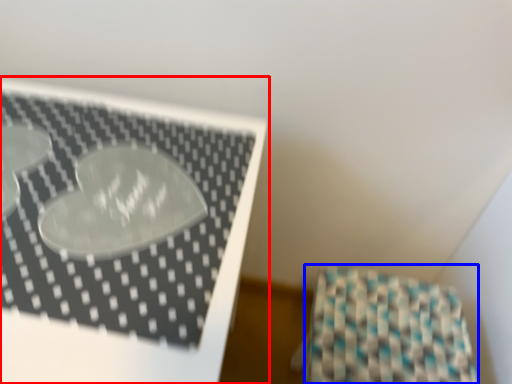
Question: Among these objects, which one is farthest to the camera, furniture (highlighted by a red box) or wrapping paper (highlighted by a blue box)?

Choices:
 (A) furniture
 (B) wrapping paper

Answer: (B)